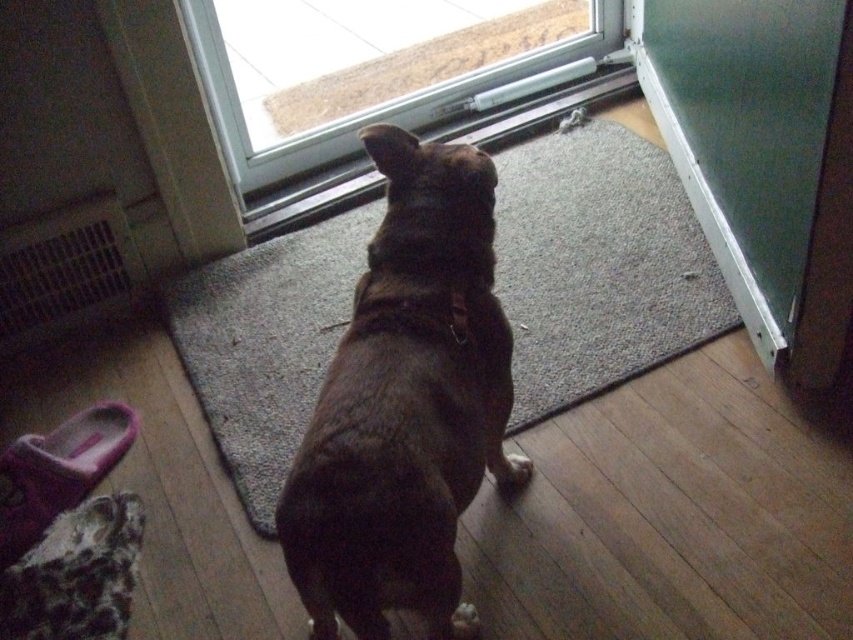
You are a delivery person trying to enter the house through the transparent glass door at upper center and the green glass screen door at upper right. Which door should you open first?

You should open the transparent glass door at upper center first because the green glass screen door at upper right is behind it, so you need to go through the transparent glass door at upper center first to reach the green glass screen door at upper right.

Where is the brown fur dog at center located in the image?

The brown fur dog at center is located at point 0.633 on the x axis and 0.476 on the y axis.

You are a delivery person approaching the brown fur dog at center and the transparent glass door at upper center. Which object is closer to you as you enter the house?

The brown fur dog at center is closer to you than the transparent glass door at upper center because it is positioned nearer to the viewer.